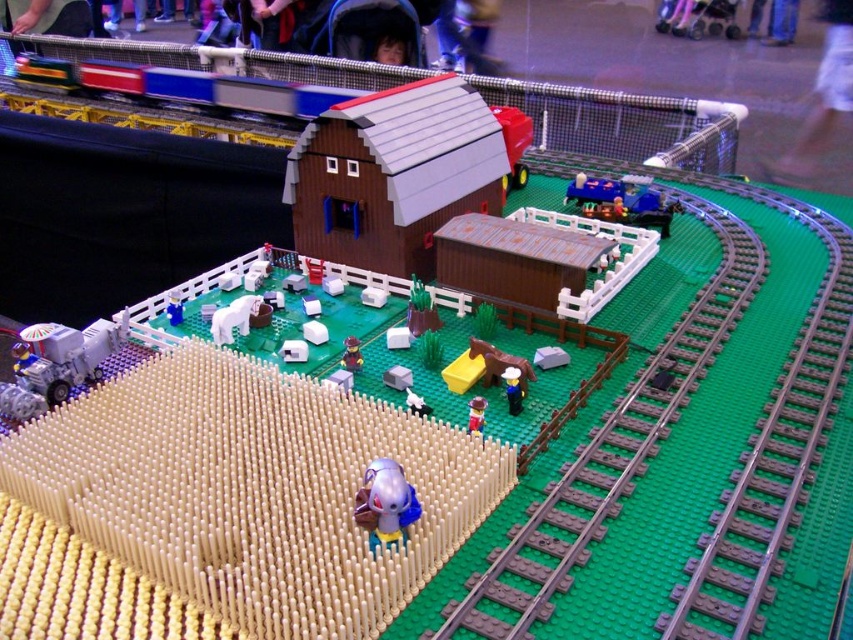
What are the coordinates of `smooth plastic figure at center` in the screenshot? It's located at (251, 490).

What do you see at coordinates (251, 490) in the screenshot?
I see `smooth plastic figure at center` at bounding box center [251, 490].

Describe the element at coordinates (251, 490) in the screenshot. This screenshot has width=853, height=640. I see `smooth plastic figure at center` at that location.

I want to click on smooth plastic figure at center, so click(251, 490).

Between point (506, 387) and point (413, 406), which one is positioned behind?

The point (506, 387) is more distant.

In the scene shown: Does smooth yellow minifigure at center appear on the right side of white matte cow at center?

Indeed, smooth yellow minifigure at center is positioned on the right side of white matte cow at center.

Between point (521, 403) and point (409, 397), which one is positioned in front?

Positioned in front is point (409, 397).

Where is `smooth yellow minifigure at center`? The image size is (853, 640). smooth yellow minifigure at center is located at coordinates (514, 388).

Is white plastic tractor at lower left positioned in front of translucent purple figure at center?

No, it is behind translucent purple figure at center.

Does white plastic tractor at lower left have a smaller size compared to translucent purple figure at center?

Incorrect, white plastic tractor at lower left is not smaller in size than translucent purple figure at center.

Is point (70, 342) more distant than point (387, 499)?

Yes, it is.

Locate an element on the screen. The image size is (853, 640). white plastic tractor at lower left is located at coordinates (67, 355).